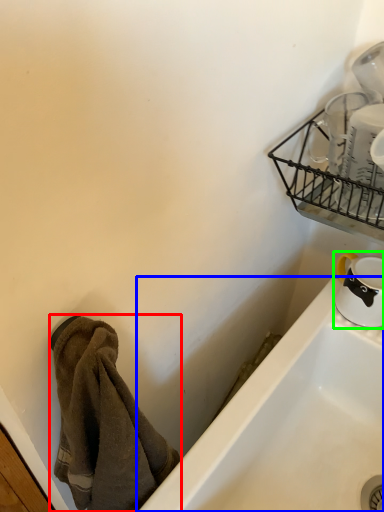
Question: Which object is the farthest from towel/napkin (highlighted by a red box)? Choose among these: bathtub (highlighted by a blue box) or tableware (highlighted by a green box).

Choices:
 (A) bathtub
 (B) tableware

Answer: (B)